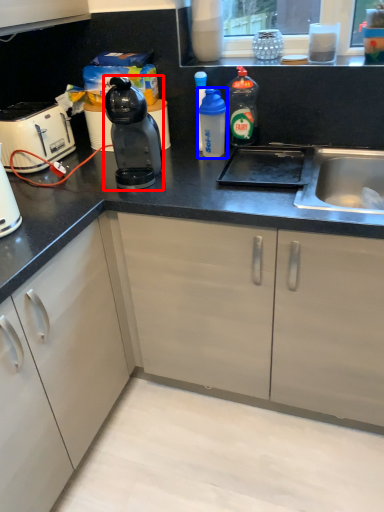
Question: Which object appears closest to the camera in this image, kitchen appliance (highlighted by a red box) or bottle (highlighted by a blue box)?

Choices:
 (A) kitchen appliance
 (B) bottle

Answer: (A)